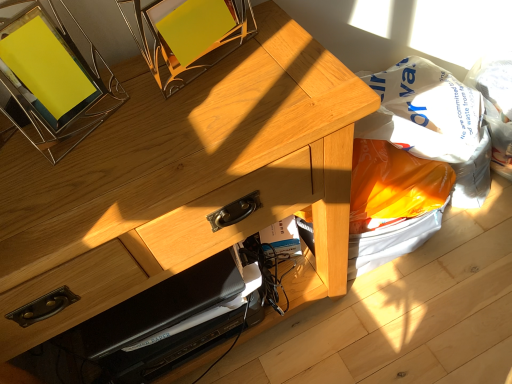
Question: Looking at their shapes, would you say orange plastic bag at lower right is wider or thinner than metallic yellow picture frame at upper left?

Choices:
 (A) wide
 (B) thin

Answer: (A)

Question: From the image's perspective, is orange plastic bag at lower right located above or below metallic yellow picture frame at upper left?

Choices:
 (A) above
 (B) below

Answer: (B)

Question: Based on their relative distances, which object is farther from the white plastic grocery bag at lower right?

Choices:
 (A) metallic yellow picture frame at upper left
 (B) orange plastic bag at lower right
 (C) natural wood desk at center

Answer: (A)

Question: Considering the real-world distances, which object is closest to the natural wood desk at center?

Choices:
 (A) white plastic grocery bag at lower right
 (B) metallic yellow picture frame at upper left
 (C) orange plastic bag at lower right

Answer: (B)